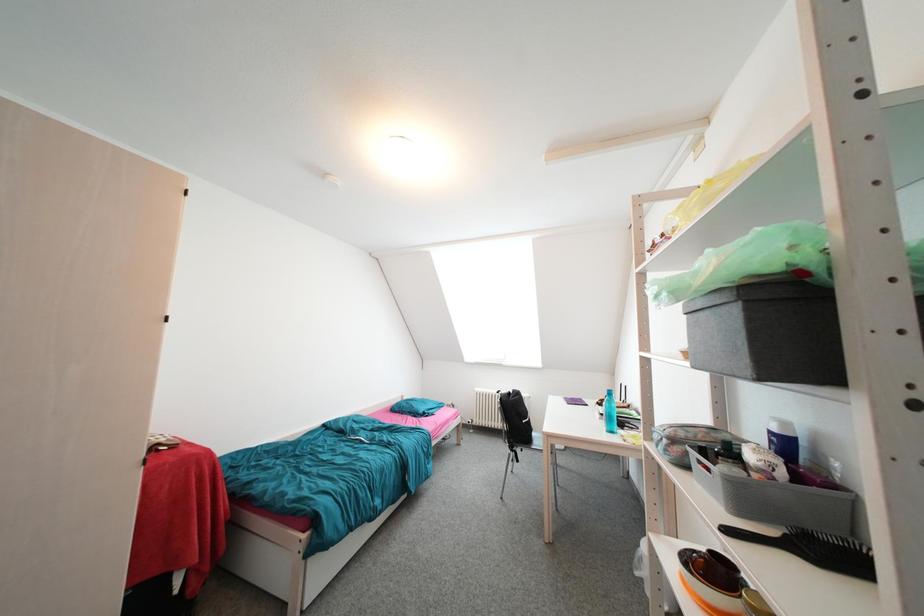
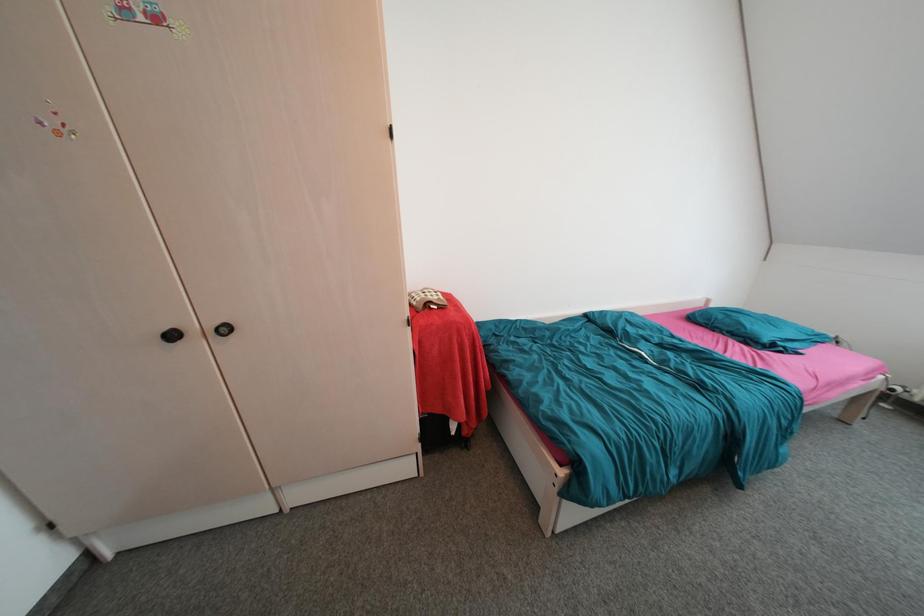
First-person continuous shooting, in which direction is the camera rotating?

The camera rotated toward left-down.